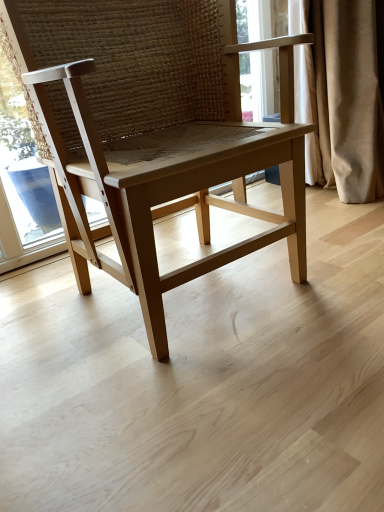
Question: Is point (354, 148) positioned closer to the camera than point (218, 250)?

Choices:
 (A) closer
 (B) farther

Answer: (B)

Question: From the image's perspective, relative to light wood chair at center, is beige velvet curtain at right above or below?

Choices:
 (A) below
 (B) above

Answer: (B)

Question: In terms of size, does beige velvet curtain at right appear bigger or smaller than light wood chair at center?

Choices:
 (A) small
 (B) big

Answer: (A)

Question: Do you think light wood chair at center is within beige velvet curtain at right, or outside of it?

Choices:
 (A) outside
 (B) inside

Answer: (A)

Question: Does point (107, 70) appear closer or farther from the camera than point (319, 112)?

Choices:
 (A) farther
 (B) closer

Answer: (B)

Question: From the image's perspective, is light wood chair at center above or below beige velvet curtain at right?

Choices:
 (A) below
 (B) above

Answer: (A)

Question: In the image, is light wood chair at center positioned in front of or behind beige velvet curtain at right?

Choices:
 (A) behind
 (B) front

Answer: (B)